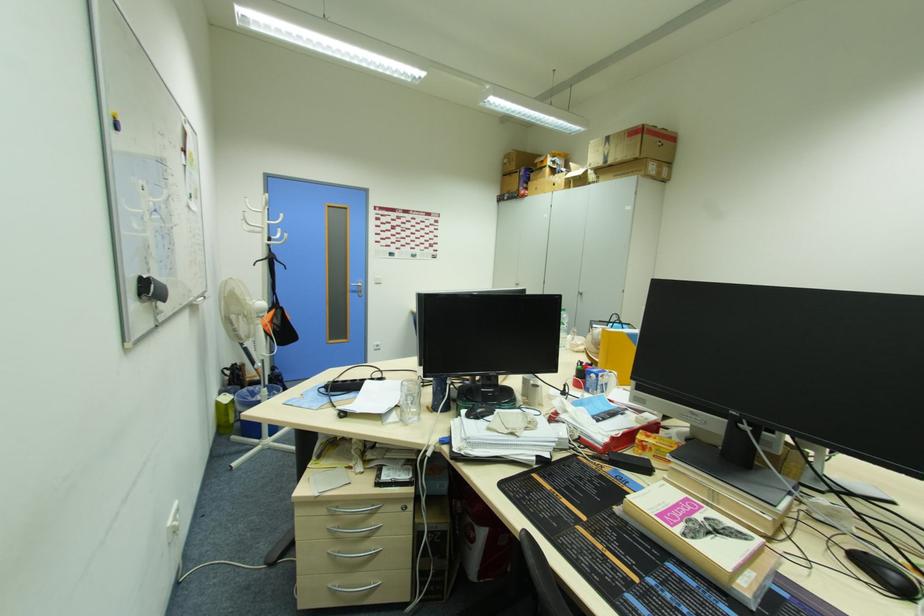
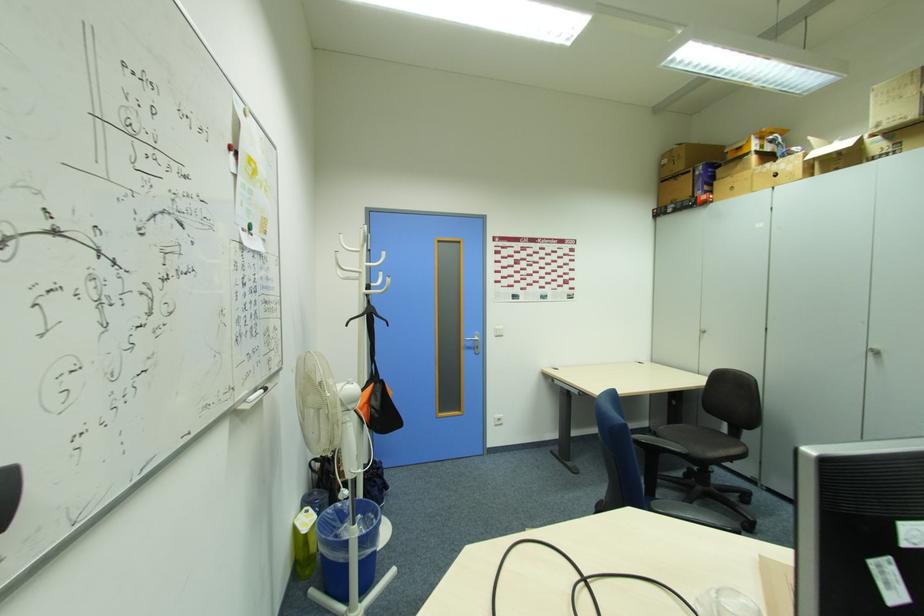
Which direction would the cameraman need to move to produce the second image?

The cameraman moved toward left, forward.